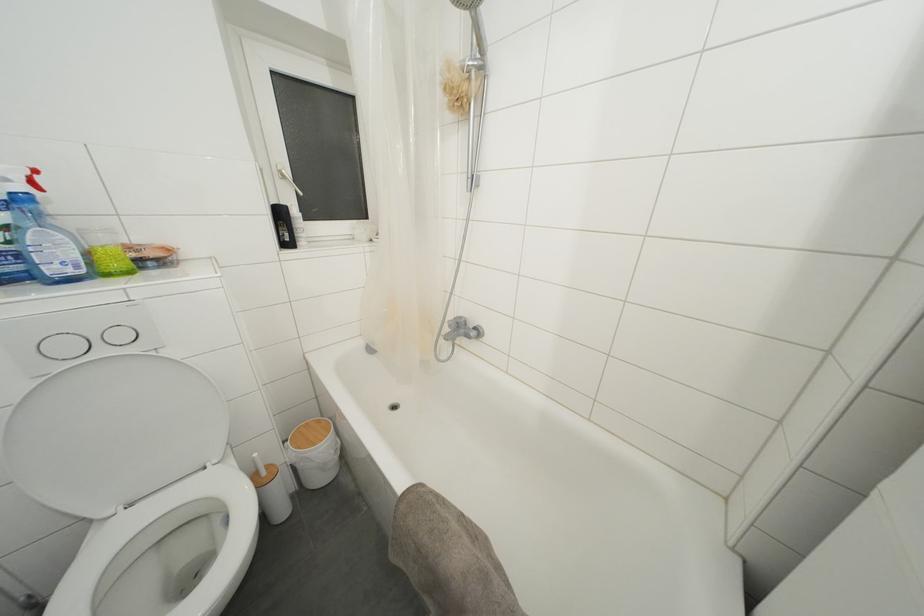
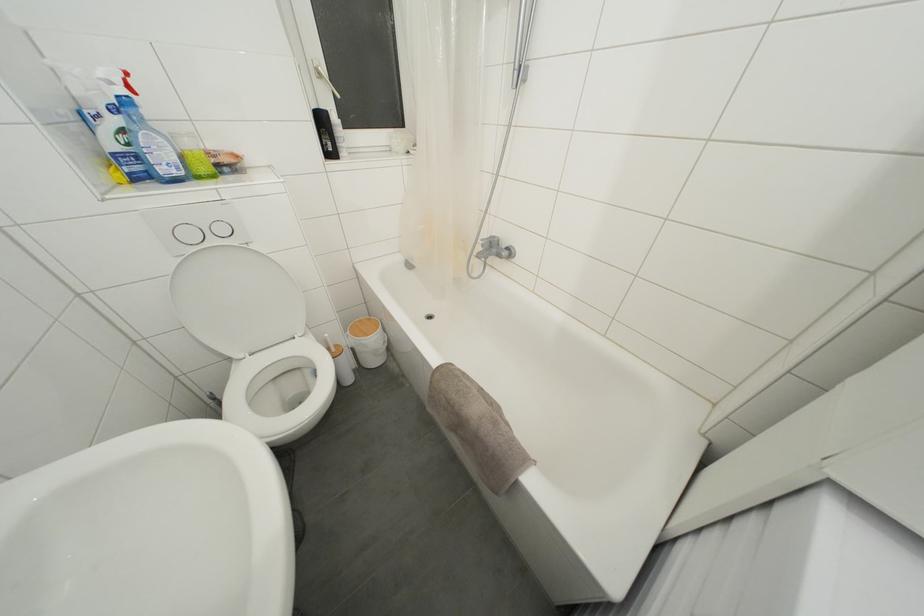
Find the pixel in the second image that matches pixel 310 429 in the first image.

(363, 326)